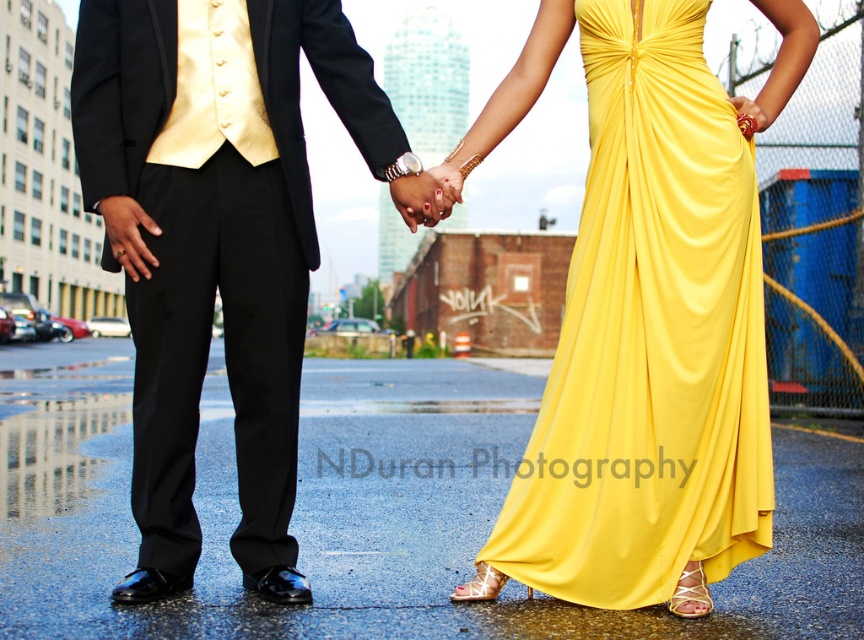
Question: Which point is closer to the camera?

Choices:
 (A) (255, 227)
 (B) (720, 477)

Answer: (B)

Question: Which point appears closest to the camera in this image?

Choices:
 (A) (716, 320)
 (B) (170, 163)

Answer: (A)

Question: Does satin yellow dress at center have a lesser width compared to shiny black suit at center?

Choices:
 (A) no
 (B) yes

Answer: (B)

Question: Is satin yellow dress at center smaller than shiny black suit at center?

Choices:
 (A) no
 (B) yes

Answer: (B)

Question: Is the position of satin yellow dress at center less distant than that of shiny black suit at center?

Choices:
 (A) yes
 (B) no

Answer: (A)